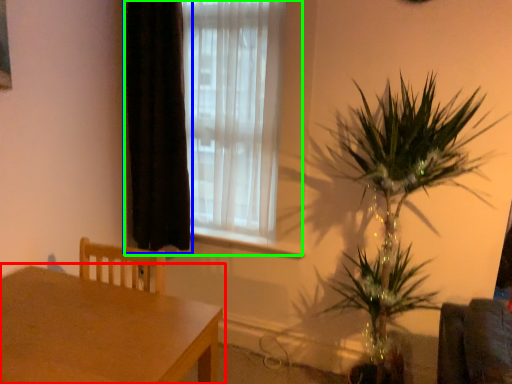
Question: Considering the real-world distances, which object is closest to table (highlighted by a red box)? curtain (highlighted by a blue box) or window (highlighted by a green box).

Choices:
 (A) curtain
 (B) window

Answer: (A)